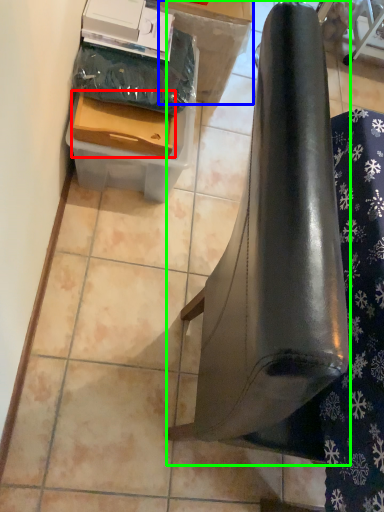
Question: Based on their relative distances, which object is nearer to drawer (highlighted by a red box)? Choose from cardboard box (highlighted by a blue box) and furniture (highlighted by a green box).

Choices:
 (A) cardboard box
 (B) furniture

Answer: (A)